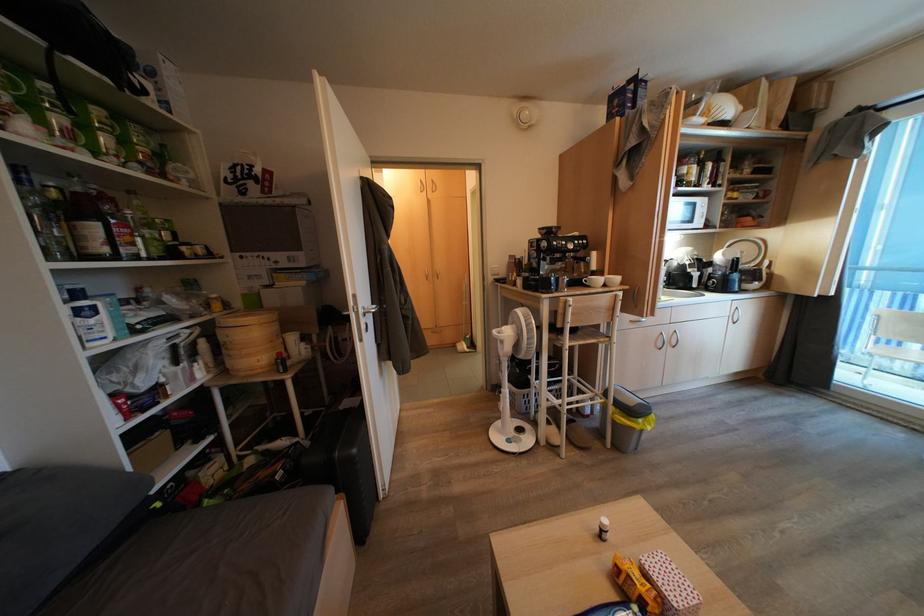
Where would you press the trash can pedal? Please return your answer as a coordinate pair (x, y).

(627, 419)